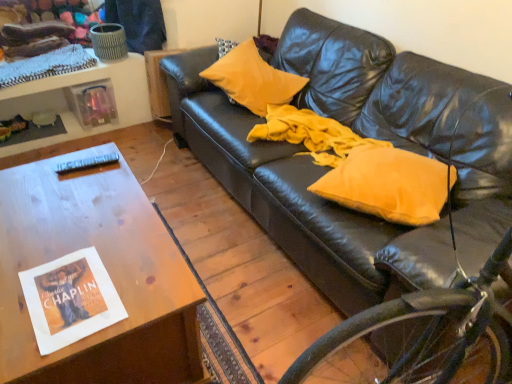
Question: Is leather couch at center next to yellow fabric pillow at center, acting as the 1th pillow starting from the right?

Choices:
 (A) no
 (B) yes

Answer: (A)

Question: Does leather couch at center have a lesser width compared to yellow fabric pillow at center, which is the 1th pillow in front-to-back order?

Choices:
 (A) no
 (B) yes

Answer: (A)

Question: Is leather couch at center shorter than yellow fabric pillow at center, which is the 2th pillow in back-to-front order?

Choices:
 (A) no
 (B) yes

Answer: (A)

Question: Would you say leather couch at center is a long distance from yellow fabric pillow at center, which is the 1th pillow in front-to-back order?

Choices:
 (A) no
 (B) yes

Answer: (A)

Question: From a real-world perspective, does leather couch at center sit lower than yellow fabric pillow at center, which is the 1th pillow in front-to-back order?

Choices:
 (A) no
 (B) yes

Answer: (A)

Question: Relative to black plastic remote control at upper left, is white paper magazine at lower left in front or behind?

Choices:
 (A) behind
 (B) front

Answer: (B)

Question: Based on their positions, is white paper magazine at lower left located to the left or right of black plastic remote control at upper left?

Choices:
 (A) right
 (B) left

Answer: (A)

Question: Is point (51, 299) closer or farther from the camera than point (105, 160)?

Choices:
 (A) closer
 (B) farther

Answer: (A)

Question: From the image's perspective, is white paper magazine at lower left located above or below black plastic remote control at upper left?

Choices:
 (A) below
 (B) above

Answer: (A)

Question: Is white paper magazine at lower left bigger or smaller than leather couch at center?

Choices:
 (A) big
 (B) small

Answer: (B)

Question: Is white paper magazine at lower left wider or thinner than leather couch at center?

Choices:
 (A) thin
 (B) wide

Answer: (A)

Question: Based on their positions, is white paper magazine at lower left located to the left or right of leather couch at center?

Choices:
 (A) right
 (B) left

Answer: (B)

Question: From a real-world perspective, is white paper magazine at lower left above or below leather couch at center?

Choices:
 (A) above
 (B) below

Answer: (B)

Question: From the image's perspective, is yellow fabric pillow at center, which is the 2th pillow in back-to-front order, above or below yellow matte pillow at upper center, which is the 2th pillow in right-to-left order?

Choices:
 (A) below
 (B) above

Answer: (A)

Question: Is point (403, 170) positioned closer to the camera than point (219, 72)?

Choices:
 (A) closer
 (B) farther

Answer: (A)